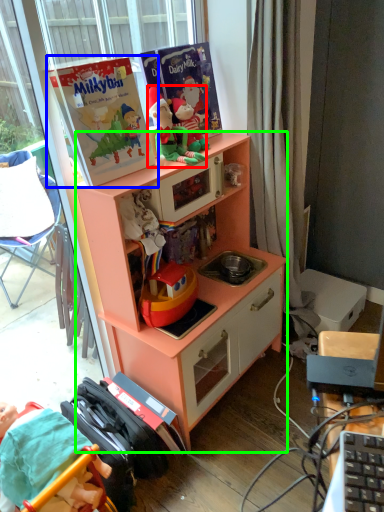
Question: Based on their relative distances, which object is farther from person (highlighted by a red box)? Choose from paperback book (highlighted by a blue box) and cabinetry (highlighted by a green box).

Choices:
 (A) paperback book
 (B) cabinetry

Answer: (B)